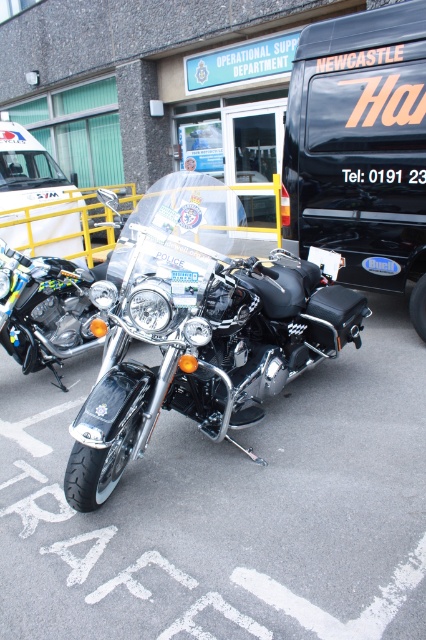
Is point (311, 298) farther from viewer compared to point (81, 307)?

No, it is not.

Is polished chrome motorcycle at center bigger than shiny chrome motorcycle at center?

Yes, polished chrome motorcycle at center is bigger than shiny chrome motorcycle at center.

Does point (100, 486) come in front of point (5, 332)?

Yes, it is in front of point (5, 332).

Image resolution: width=426 pixels, height=640 pixels. I want to click on polished chrome motorcycle at center, so click(x=198, y=336).

Can you confirm if black matte van at center is smaller than white plastic ambulance at left?

Correct, black matte van at center occupies less space than white plastic ambulance at left.

Image resolution: width=426 pixels, height=640 pixels. What are the coordinates of `black matte van at center` in the screenshot? It's located at (360, 148).

You are a GUI agent. You are given a task and a screenshot of the screen. Output one action in this format:
    pyautogui.click(x=<x>, y=<y>)
    Task: Click on the black matte van at center
    
    Given the screenshot: What is the action you would take?
    pyautogui.click(x=360, y=148)

Identify the location of black matte van at center. (360, 148).

Does point (284, 221) lie in front of point (46, 291)?

No, (284, 221) is further to viewer.

Image resolution: width=426 pixels, height=640 pixels. I want to click on black matte van at center, so click(360, 148).

Is point (345, 276) in front of point (17, 356)?

No, it is behind (17, 356).

The height and width of the screenshot is (640, 426). In order to click on black matte van at center in this screenshot , I will do `click(360, 148)`.